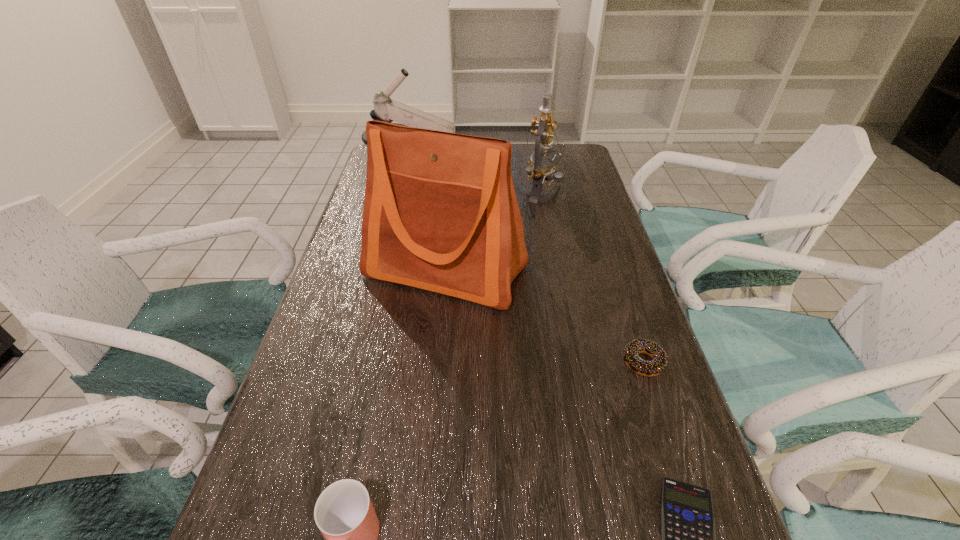
In order to click on the third farthest object in this screenshot , I will do `click(440, 213)`.

Where is `the left microscope`? This screenshot has width=960, height=540. the left microscope is located at coordinates (385, 109).

This screenshot has height=540, width=960. In order to click on the third object from right to left in this screenshot , I will do `click(541, 169)`.

The width and height of the screenshot is (960, 540). What are the coordinates of `the fifth tallest object` in the screenshot? It's located at (658, 364).

At what (x,y) coordinates should I click in order to perform the action: click on the fourth farthest object. Please return your answer as a coordinate pair (x, y). The image size is (960, 540). Looking at the image, I should click on (658, 364).

You are a GUI agent. You are given a task and a screenshot of the screen. Output one action in this format:
    pyautogui.click(x=<x>, y=<y>)
    Task: Click on the vacant space located on the front of the shopping bag
    The height and width of the screenshot is (540, 960).
    Given the screenshot: What is the action you would take?
    pyautogui.click(x=432, y=424)

Locate an element on the screen. This screenshot has height=540, width=960. free space located 0.300m at the eyepiece of the left microscope is located at coordinates (549, 182).

Find the location of `vacant space located 0.360m on the left of the fourth object from left to right`. vacant space located 0.360m on the left of the fourth object from left to right is located at coordinates (413, 193).

This screenshot has height=540, width=960. I want to click on vacant region located 0.380m on the left of the fifth tallest object, so click(440, 362).

Locate an element on the screen. Image resolution: width=960 pixels, height=540 pixels. object that is at the far edge is located at coordinates (385, 109).